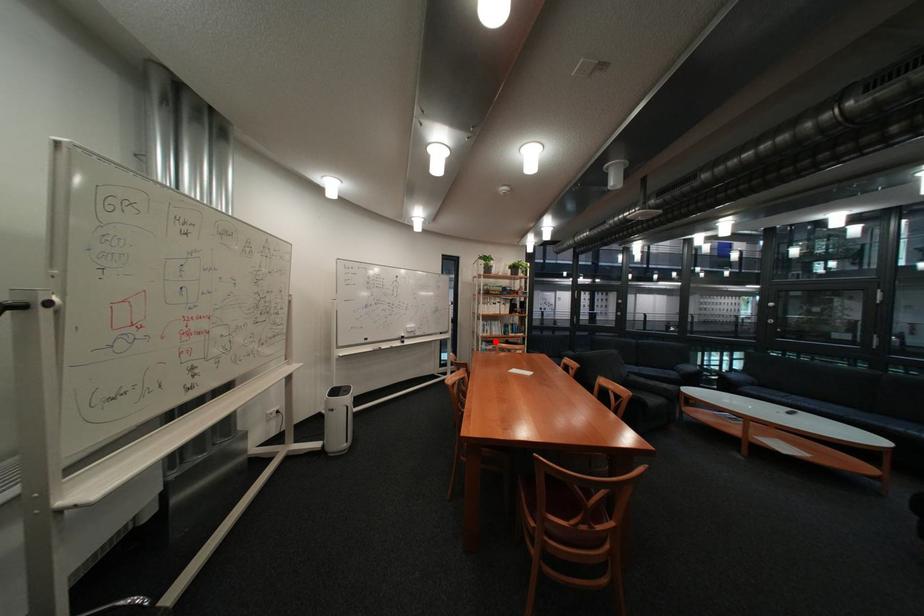
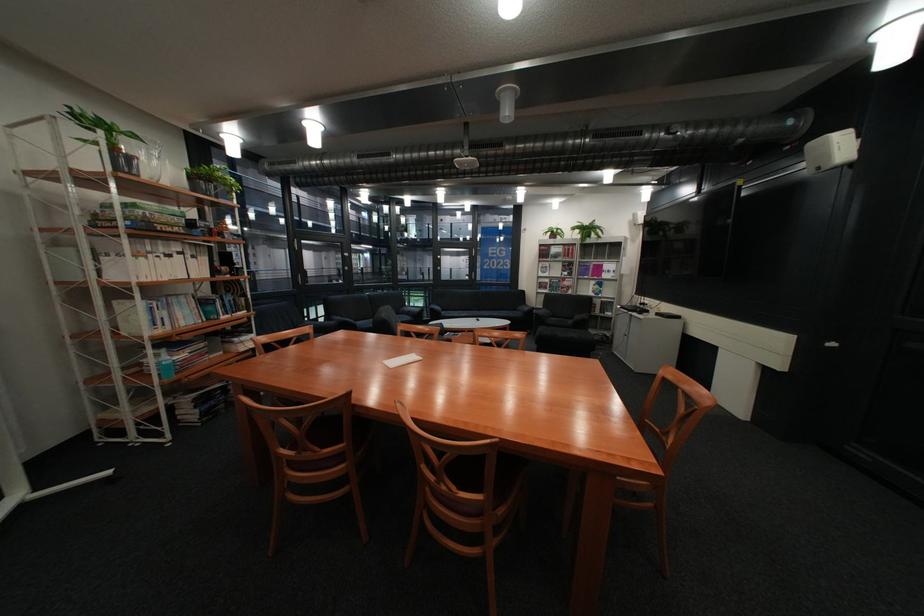
The point at the highlighted location is marked in the first image. Where is the corresponding point in the second image?

(165, 351)